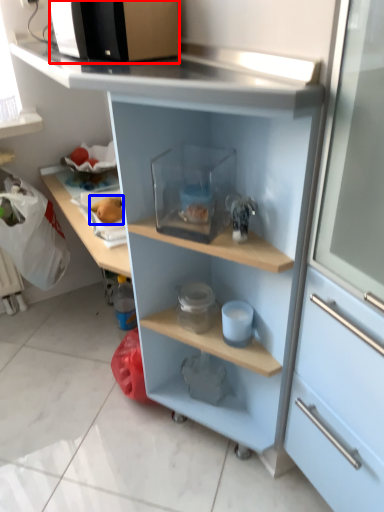
Question: Which of the following is the closest to the observer, microwave oven (highlighted by a red box) or food (highlighted by a blue box)?

Choices:
 (A) microwave oven
 (B) food

Answer: (A)